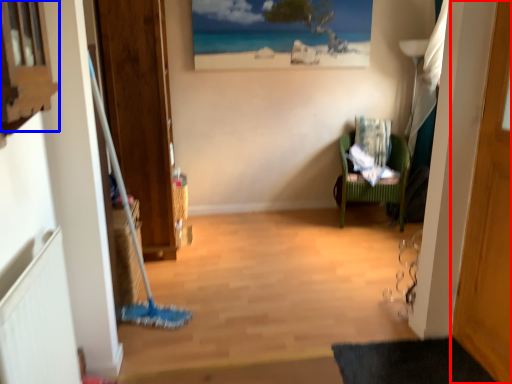
Question: Which object is further to the camera taking this photo, door (highlighted by a red box) or window (highlighted by a blue box)?

Choices:
 (A) door
 (B) window

Answer: (A)